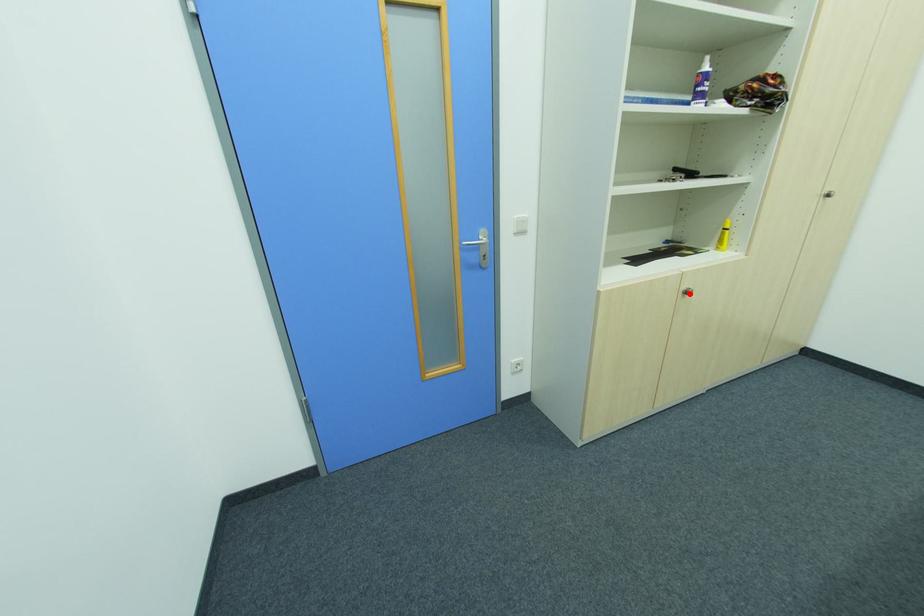
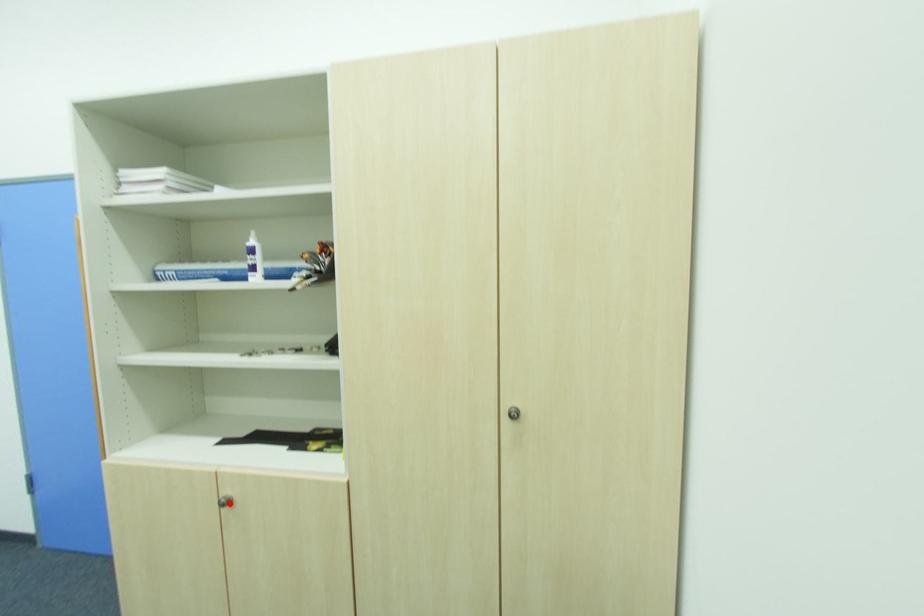
I am providing you with two images of the same scene from different viewpoints. A red point is marked on the first image and another point is marked on the second image. Are the points marked in image1 and image2 representing the same 3D position?

Yes